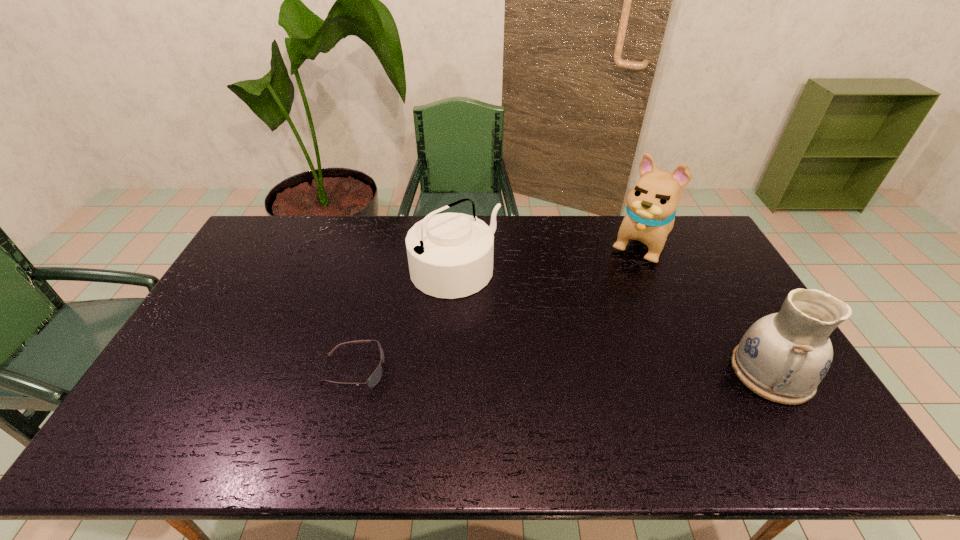
I want to click on vacant region that satisfies the following two spatial constraints: 1. on the front side of the pottery; 2. on the right side of the second object from left to right, so click(449, 372).